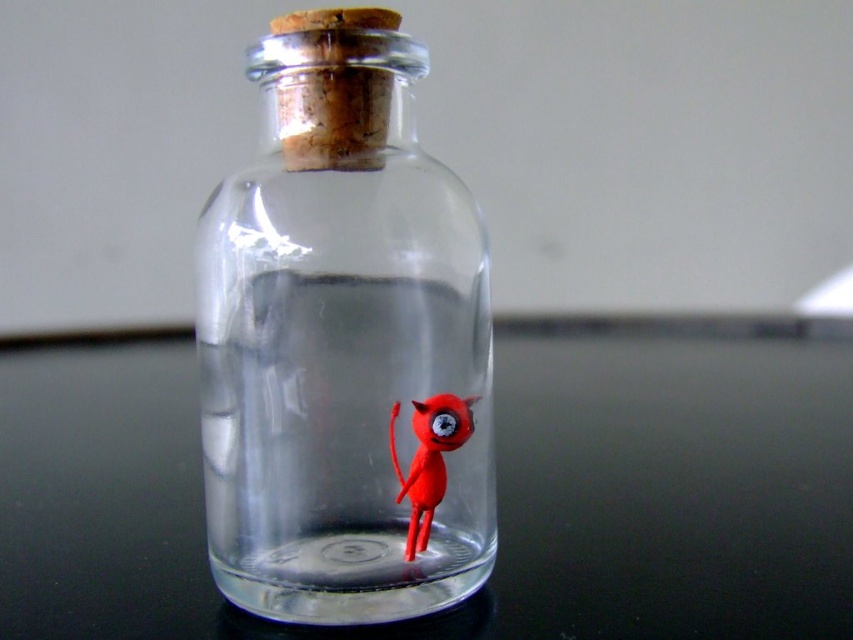
Question: Is black glass table at center wider than transparent glass bottle at center?

Choices:
 (A) yes
 (B) no

Answer: (A)

Question: Estimate the real-world distances between objects in this image. Which object is closer to the transparent glass bottle at center?

Choices:
 (A) black glass table at center
 (B) rubber matte toy at center

Answer: (B)

Question: Which of the following is the farthest from the observer?

Choices:
 (A) (461, 432)
 (B) (68, 595)

Answer: (B)

Question: In this image, where is black glass table at center located relative to rubber matte toy at center?

Choices:
 (A) above
 (B) below

Answer: (A)

Question: Observing the image, what is the correct spatial positioning of black glass table at center in reference to rubber matte toy at center?

Choices:
 (A) above
 (B) below

Answer: (A)

Question: Which of the following is the closest to the observer?

Choices:
 (A) (173, 339)
 (B) (425, 536)

Answer: (B)